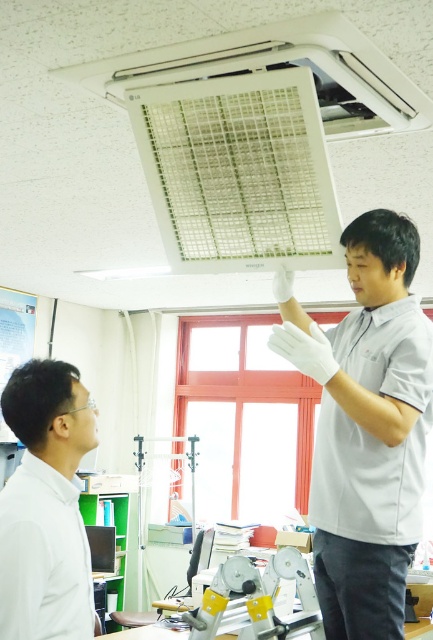
Question: Which object appears farthest from the camera in this image?

Choices:
 (A) white plastic exhaust hood at upper center
 (B) white matte gloves at upper center

Answer: (A)

Question: Does white matte shirt at upper left have a lesser width compared to white plastic exhaust hood at upper center?

Choices:
 (A) yes
 (B) no

Answer: (A)

Question: Where is white matte gloves at upper center located in relation to white plastic exhaust hood at upper center in the image?

Choices:
 (A) left
 (B) right

Answer: (B)

Question: Which of the following is the closest to the observer?

Choices:
 (A) white plastic exhaust hood at upper center
 (B) white matte gloves at upper center

Answer: (B)

Question: Which point is farther from the camera taking this photo?

Choices:
 (A) (54, 484)
 (B) (396, 92)
 (C) (398, 384)

Answer: (B)

Question: Is white matte gloves at upper center wider than white plastic exhaust hood at upper center?

Choices:
 (A) no
 (B) yes

Answer: (A)